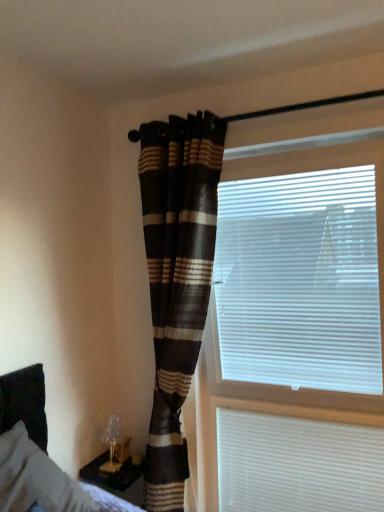
Question: Does plaid fabric curtain at center have a lesser width compared to white plastic blinds at right, which ranks as the first window blind in top-to-bottom order?

Choices:
 (A) yes
 (B) no

Answer: (B)

Question: From a real-world perspective, is plaid fabric curtain at center positioned under white plastic blinds at right, which ranks as the first window blind in top-to-bottom order, based on gravity?

Choices:
 (A) yes
 (B) no

Answer: (A)

Question: Is plaid fabric curtain at center positioned far away from white plastic blinds at right, which is the 2th window blind in bottom-to-top order?

Choices:
 (A) yes
 (B) no

Answer: (B)

Question: Is plaid fabric curtain at center at the right side of white plastic blinds at right, which ranks as the first window blind in top-to-bottom order?

Choices:
 (A) yes
 (B) no

Answer: (B)

Question: Does plaid fabric curtain at center have a lesser height compared to white plastic blinds at right, which ranks as the first window blind in top-to-bottom order?

Choices:
 (A) no
 (B) yes

Answer: (A)

Question: Is white plastic blinds at lower right, the second window blind positioned from the top, in front of or behind gray fabric bed at lower left in the image?

Choices:
 (A) behind
 (B) front

Answer: (A)

Question: Considering the positions of white plastic blinds at lower right, the second window blind positioned from the top, and gray fabric bed at lower left in the image, is white plastic blinds at lower right, the second window blind positioned from the top, bigger or smaller than gray fabric bed at lower left?

Choices:
 (A) big
 (B) small

Answer: (B)

Question: Would you say white plastic blinds at lower right, arranged as the 1th window blind when ordered from the bottom, is to the left or to the right of gray fabric bed at lower left in the picture?

Choices:
 (A) left
 (B) right

Answer: (B)

Question: From the image's perspective, is white plastic blinds at lower right, arranged as the 1th window blind when ordered from the bottom, located above or below gray fabric bed at lower left?

Choices:
 (A) below
 (B) above

Answer: (A)

Question: Based on their sizes in the image, would you say plaid fabric curtain at center is bigger or smaller than white plastic blinds at lower right, arranged as the 1th window blind when ordered from the bottom?

Choices:
 (A) big
 (B) small

Answer: (A)

Question: Choose the correct answer: Is plaid fabric curtain at center inside white plastic blinds at lower right, arranged as the 1th window blind when ordered from the bottom, or outside it?

Choices:
 (A) inside
 (B) outside

Answer: (B)

Question: Is point (152, 457) closer or farther from the camera than point (372, 487)?

Choices:
 (A) farther
 (B) closer

Answer: (A)

Question: Relative to white plastic blinds at lower right, the second window blind positioned from the top, is plaid fabric curtain at center in front or behind?

Choices:
 (A) behind
 (B) front

Answer: (B)

Question: Considering the positions of white plastic blinds at lower right, the second window blind positioned from the top, and plaid fabric curtain at center in the image, is white plastic blinds at lower right, the second window blind positioned from the top, taller or shorter than plaid fabric curtain at center?

Choices:
 (A) short
 (B) tall

Answer: (A)

Question: Does point (354, 439) appear closer or farther from the camera than point (198, 311)?

Choices:
 (A) farther
 (B) closer

Answer: (B)